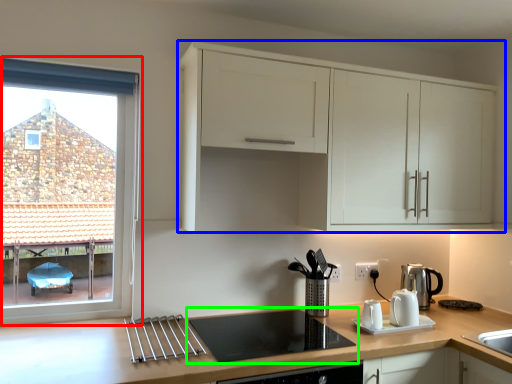
Question: Based on their relative distances, which object is nearer to window (highlighted by a red box)? Choose from cabinetry (highlighted by a blue box) and gas stove (highlighted by a green box).

Choices:
 (A) cabinetry
 (B) gas stove

Answer: (B)